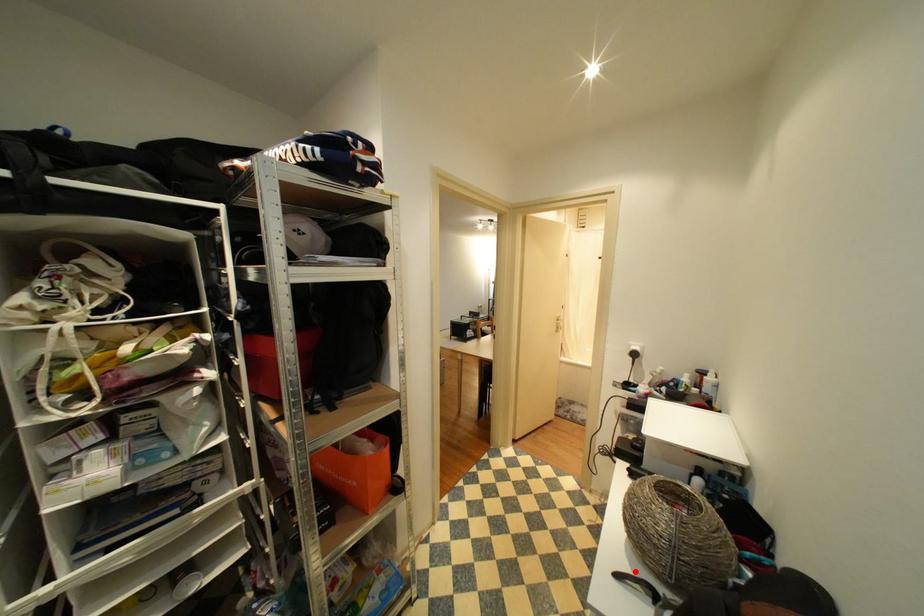
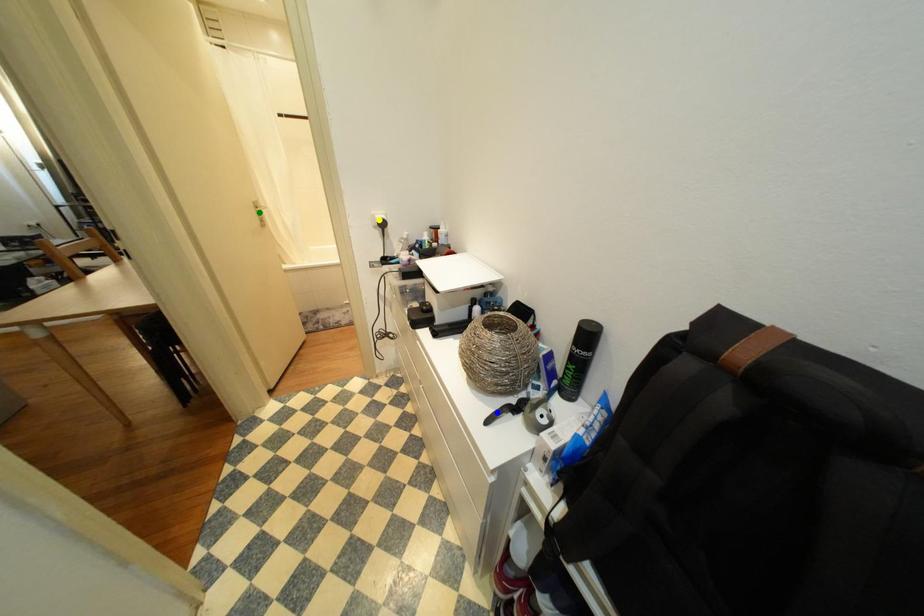
Question: I am providing you with two images of the same scene from different viewpoints. A red point is marked on the first image. You are given multiple points on the second image. Which mark in image 2 goes with the point in image 1?

Choices:
 (A) green point
 (B) blue point
 (C) yellow point

Answer: (B)